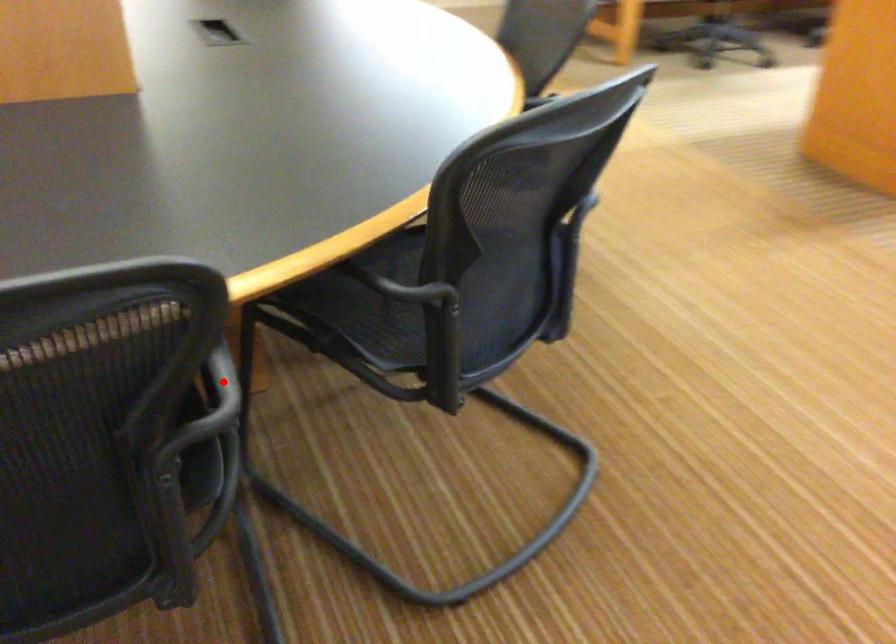
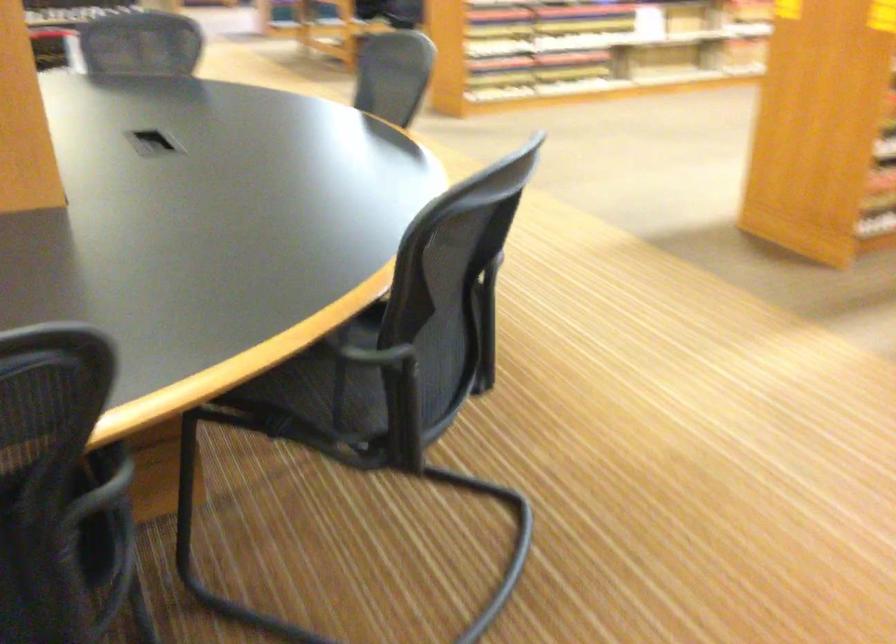
Question: I am providing you with two images of the same scene from different viewpoints. A red point is marked on the first image. At the location where the point appears in image 1, is it still visible in image 2?

Choices:
 (A) Yes
 (B) No

Answer: (B)